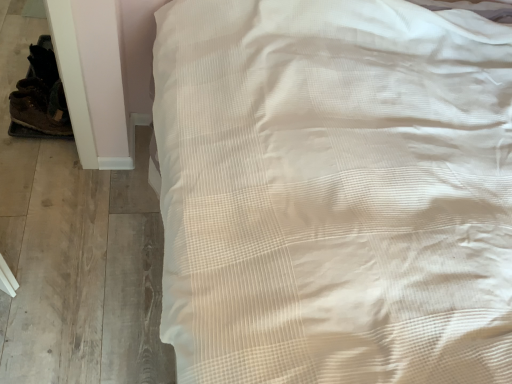
At what (x,y) coordinates should I click in order to perform the action: click on white textured bed at upper right. Please return your answer as a coordinate pair (x, y). The width and height of the screenshot is (512, 384). Looking at the image, I should click on (335, 192).

The height and width of the screenshot is (384, 512). What do you see at coordinates (335, 192) in the screenshot?
I see `white textured bed at upper right` at bounding box center [335, 192].

The image size is (512, 384). Describe the element at coordinates (35, 113) in the screenshot. I see `brown leather shoe at left` at that location.

Measure the distance between point (x=69, y=133) and camera.

5.75 feet.

Identify the location of brown leather shoe at left. (35, 113).

At what (x,y) coordinates should I click in order to perform the action: click on white textured bed at upper right. Please return your answer as a coordinate pair (x, y). The image size is (512, 384). Looking at the image, I should click on (335, 192).

Is white textured bed at upper right at the right side of brown leather shoe at left?

Indeed, white textured bed at upper right is positioned on the right side of brown leather shoe at left.

Is white textured bed at upper right in front of brown leather shoe at left?

Yes.

Between point (398, 198) and point (44, 100), which one is positioned behind?

Point (44, 100)

From the image's perspective, is white textured bed at upper right beneath brown leather shoe at left?

Indeed, from the image's perspective, white textured bed at upper right is shown beneath brown leather shoe at left.

Consider the image. From a real-world perspective, between white textured bed at upper right and brown leather shoe at left, who is vertically higher?

white textured bed at upper right is physically above.

Considering the sizes of objects white textured bed at upper right and brown leather shoe at left in the image provided, who is wider, white textured bed at upper right or brown leather shoe at left?

Wider between the two is white textured bed at upper right.

Is white textured bed at upper right shorter than brown leather shoe at left?

In fact, white textured bed at upper right may be taller than brown leather shoe at left.

Does white textured bed at upper right have a larger size compared to brown leather shoe at left?

Result: Yes.

Is brown leather shoe at left completely or partially inside white textured bed at upper right?

No, brown leather shoe at left is not a part of white textured bed at upper right.

Is white textured bed at upper right not near brown leather shoe at left?

white textured bed at upper right is positioned a significant distance from brown leather shoe at left.

Is white textured bed at upper right oriented towards brown leather shoe at left?

Result: Yes, white textured bed at upper right is aimed at brown leather shoe at left.

How much distance is there between white textured bed at upper right and brown leather shoe at left?

white textured bed at upper right and brown leather shoe at left are 3.63 feet apart.

This screenshot has width=512, height=384. I want to click on shoe above the white textured bed at upper right (from the image's perspective), so click(35, 113).

Is brown leather shoe at left at the left side of white textured bed at upper right?

Yes, brown leather shoe at left is to the left of white textured bed at upper right.

Who is more distant, brown leather shoe at left or white textured bed at upper right?

brown leather shoe at left is further away from the camera.

Is point (59, 132) behind point (231, 112)?

Yes, it is.

From the image's perspective, which one is positioned lower, brown leather shoe at left or white textured bed at upper right?

white textured bed at upper right, from the image's perspective.

In the scene shown: From a real-world perspective, relative to white textured bed at upper right, is brown leather shoe at left vertically above or below?

Clearly, from a real-world perspective, brown leather shoe at left is below white textured bed at upper right.

Which of these two, brown leather shoe at left or white textured bed at upper right, is wider?

white textured bed at upper right is wider.

Does brown leather shoe at left have a lesser height compared to white textured bed at upper right?

Indeed, brown leather shoe at left has a lesser height compared to white textured bed at upper right.

Who is smaller, brown leather shoe at left or white textured bed at upper right?

brown leather shoe at left.

Choose the correct answer: Is brown leather shoe at left inside white textured bed at upper right or outside it?

The correct answer is: outside.

Is brown leather shoe at left not close to white textured bed at upper right?

Yes, brown leather shoe at left and white textured bed at upper right are located far from each other.

Could you tell me if brown leather shoe at left is facing white textured bed at upper right?

Yes, brown leather shoe at left faces towards white textured bed at upper right.

The image size is (512, 384). Find the location of `shoe lying above the white textured bed at upper right (from the image's perspective)`. shoe lying above the white textured bed at upper right (from the image's perspective) is located at coordinates (35, 113).

Find the location of `bed below the brown leather shoe at left (from the image's perspective)`. bed below the brown leather shoe at left (from the image's perspective) is located at coordinates (335, 192).

At what (x,y) coordinates should I click in order to perform the action: click on shoe below the white textured bed at upper right (from a real-world perspective). Please return your answer as a coordinate pair (x, y). Looking at the image, I should click on (35, 113).